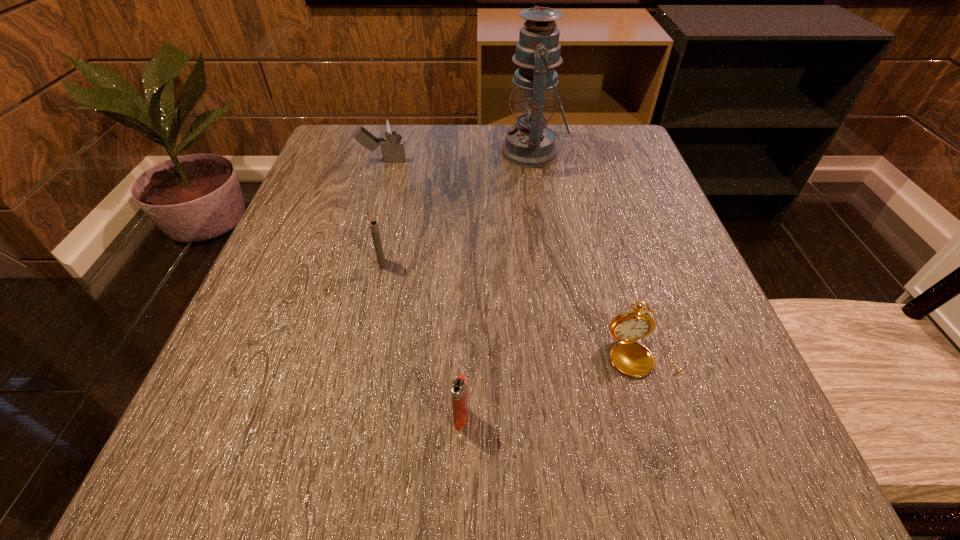
I want to click on the tallest object, so click(x=530, y=143).

The image size is (960, 540). I want to click on the farthest igniter, so click(389, 127).

The width and height of the screenshot is (960, 540). In order to click on the second nearest igniter in this screenshot , I will do `click(372, 221)`.

You are a GUI agent. You are given a task and a screenshot of the screen. Output one action in this format:
    pyautogui.click(x=<x>, y=<y>)
    Task: Click on the rightmost igniter
    Image resolution: width=960 pixels, height=540 pixels.
    Given the screenshot: What is the action you would take?
    pyautogui.click(x=458, y=387)

Identify the location of the third object from left to right. The height and width of the screenshot is (540, 960). (458, 387).

Where is `the fourth farthest object`? The width and height of the screenshot is (960, 540). the fourth farthest object is located at coordinates (631, 358).

Where is `free space located on the front-facing side of the lantern`? The width and height of the screenshot is (960, 540). free space located on the front-facing side of the lantern is located at coordinates (327, 153).

At what (x,y) coordinates should I click in order to perform the action: click on free space located on the front-facing side of the lantern. Please return your answer as a coordinate pair (x, y). The height and width of the screenshot is (540, 960). Looking at the image, I should click on (449, 153).

Find the location of a particular element. This screenshot has width=960, height=540. free space located on the front-facing side of the lantern is located at coordinates (453, 153).

Where is `free space located on the right of the farthest igniter`? The image size is (960, 540). free space located on the right of the farthest igniter is located at coordinates (477, 160).